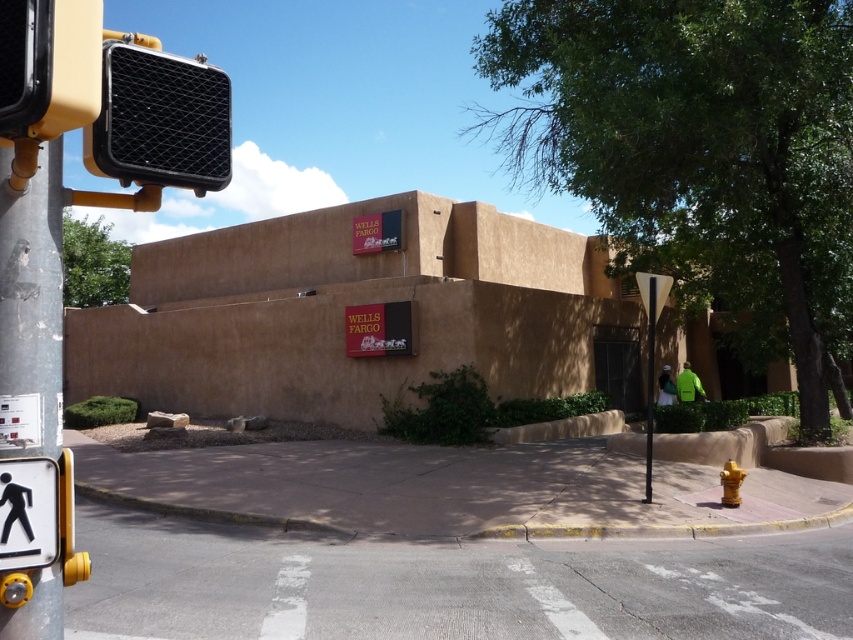
You are standing at the pedestrian crossing signal pole on the left side of the frame. Looking towards the Wells Fargo bank building, where is the metallic silver street sign at center right located relative to your position?

The metallic silver street sign at center right is located to the right of the pedestrian crossing signal pole on the left side of the frame.

You are a pedestrian trying to cross the street. You see the white plastic pedestrian sign at lower left and the metallic silver street sign at center right. Which sign is closer to the left side of the road?

The white plastic pedestrian sign at lower left is closer to the left side of the road because it is positioned to the left of the metallic silver street sign at center right.

You are a pedestrian standing at the crosswalk. You notice the black textured traffic light at upper left and the metallic silver street sign at center right. Which object is closer to you?

The black textured traffic light at upper left is closer to you as it is in front of the metallic silver street sign at center right.